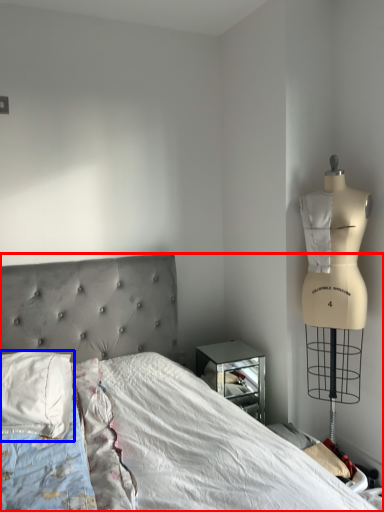
Question: Which point is further to the camera, bed (highlighted by a red box) or pillow (highlighted by a blue box)?

Choices:
 (A) bed
 (B) pillow

Answer: (B)